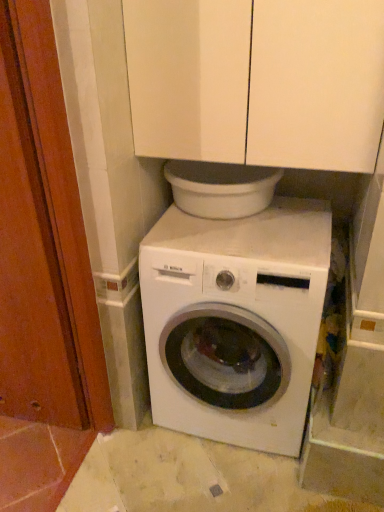
Question: Considering the relative sizes of white matte cabinet at upper center and concrete tile floor at center in the image provided, is white matte cabinet at upper center thinner than concrete tile floor at center?

Choices:
 (A) no
 (B) yes

Answer: (B)

Question: From a real-world perspective, is white matte cabinet at upper center on top of concrete tile floor at center?

Choices:
 (A) no
 (B) yes

Answer: (B)

Question: From the image's perspective, is white matte cabinet at upper center under concrete tile floor at center?

Choices:
 (A) yes
 (B) no

Answer: (B)

Question: Is white matte cabinet at upper center not inside concrete tile floor at center?

Choices:
 (A) no
 (B) yes

Answer: (B)

Question: Would you consider white matte cabinet at upper center to be distant from concrete tile floor at center?

Choices:
 (A) yes
 (B) no

Answer: (A)

Question: Is white matte cabinet at upper center in front of concrete tile floor at center?

Choices:
 (A) no
 (B) yes

Answer: (B)

Question: Is white matte cabinet at upper center oriented towards wooden screen door at left?

Choices:
 (A) no
 (B) yes

Answer: (A)

Question: Can you confirm if white matte cabinet at upper center is shorter than wooden screen door at left?

Choices:
 (A) no
 (B) yes

Answer: (B)

Question: From a real-world perspective, is white matte cabinet at upper center on wooden screen door at left?

Choices:
 (A) yes
 (B) no

Answer: (A)

Question: Does white matte cabinet at upper center appear on the left side of wooden screen door at left?

Choices:
 (A) no
 (B) yes

Answer: (A)

Question: Would you say wooden screen door at left is part of white matte cabinet at upper center's contents?

Choices:
 (A) yes
 (B) no

Answer: (B)

Question: From the image's perspective, is white matte cabinet at upper center on wooden screen door at left?

Choices:
 (A) no
 (B) yes

Answer: (B)

Question: Can you confirm if wooden screen door at left is positioned to the left of white matte cabinet at upper center?

Choices:
 (A) yes
 (B) no

Answer: (A)